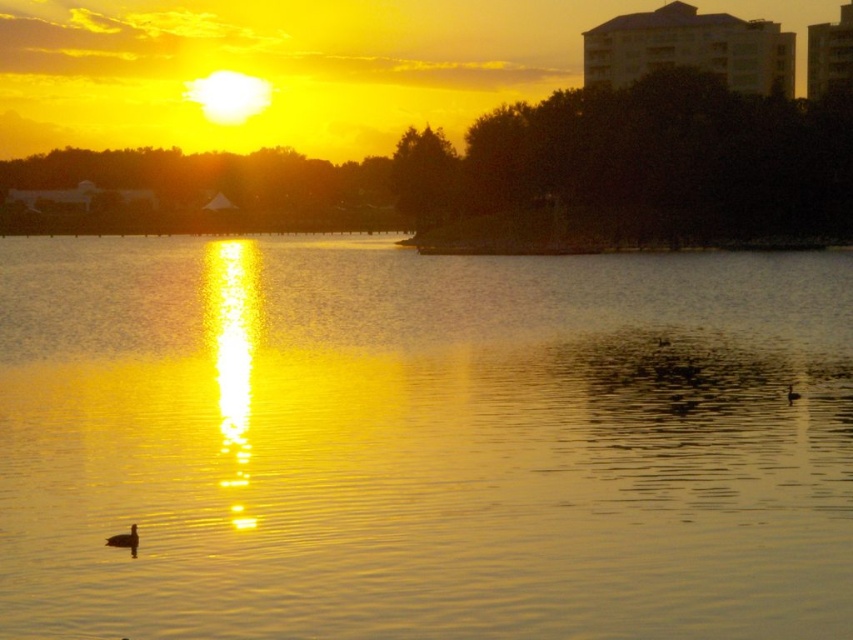
You are standing on the shore observing the golden reflective water at center and the brown matte bird at lower right. Which object is closer to you?

The golden reflective water at center is closer to you because it is in front of the brown matte bird at lower right.

You are standing at the point closest to the camera in the image. Looking towards the point farther away, which direction would you face? The two points are labeled as point (113,538) and point (790,385).

You should face towards the upper right direction because point (790,385) is farther away from the camera compared to point (113,538).